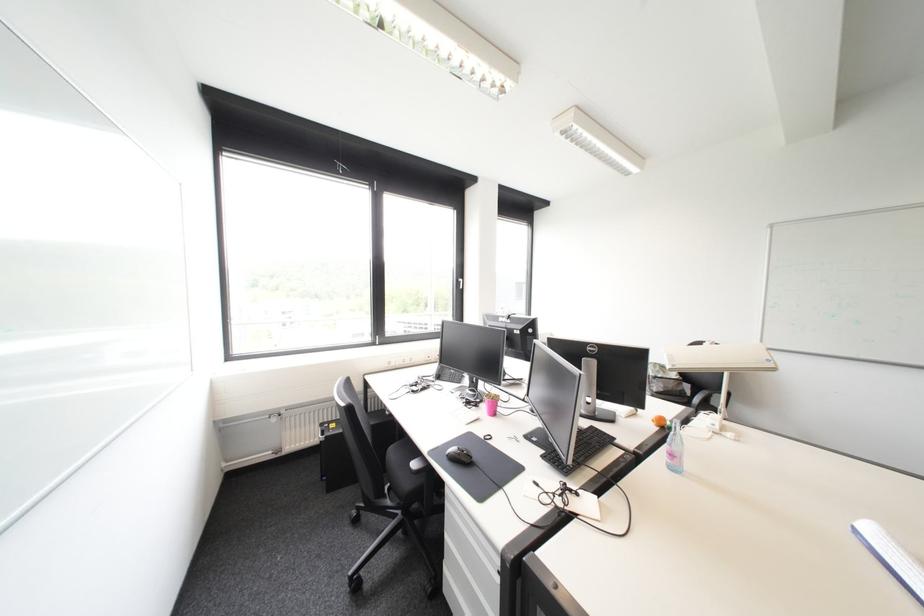
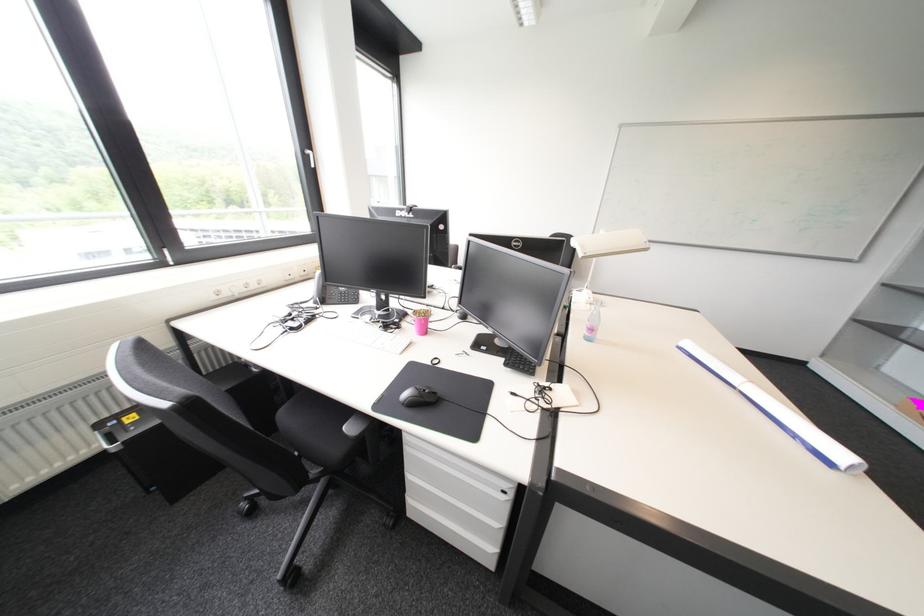
How did the camera likely rotate?

The camera's rotation is toward right-down.